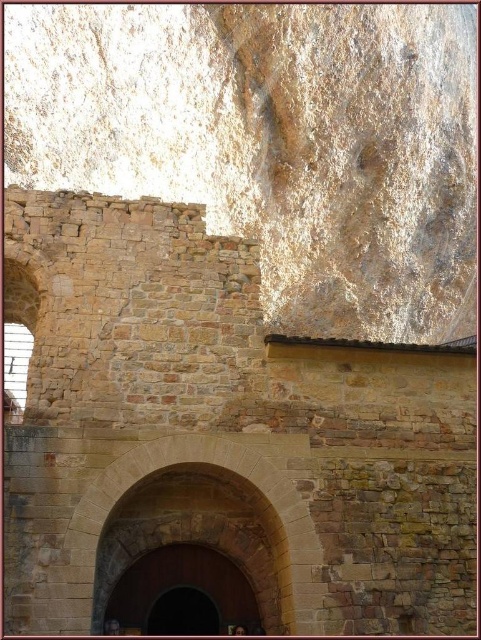
In the scene shown: You are a visitor approaching the entrance of the historical stone structure. You see the smooth stone archway at center and the brown wooden door at center. Which object is located above the other?

The smooth stone archway at center is positioned over brown wooden door at center, meaning it is above the door.

You are standing in front of a historical building and notice both the smooth stone archway at center and the brown wooden door at center. Which object is positioned to the right side when viewed from your perspective?

The smooth stone archway at center is to the right of the brown wooden door at center.

Consider the image. You are an architect examining the historical stone structure. You notice the smooth stone archway at center and the brown wooden door at center. Which object is closer to you from your current viewpoint?

The smooth stone archway at center is in front of the brown wooden door at center, so it is closer to you.